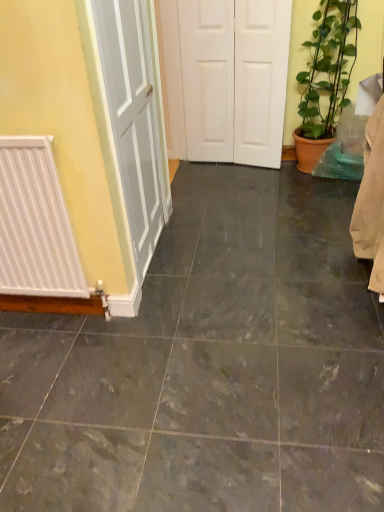
You are a GUI agent. You are given a task and a screenshot of the screen. Output one action in this format:
    pyautogui.click(x=<x>, y=<y>)
    Task: Click on the free spot in front of white matte radiator at left
    This screenshot has width=384, height=512.
    Given the screenshot: What is the action you would take?
    pyautogui.click(x=41, y=362)